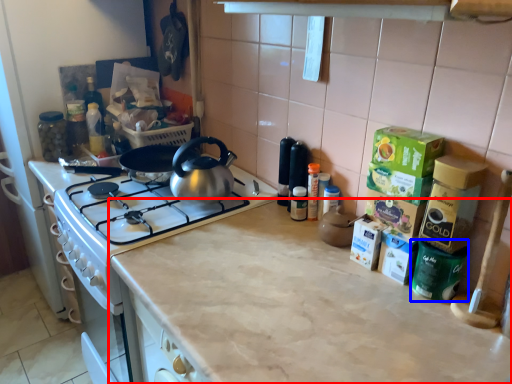
Question: Which object is further to the camera taking this photo, countertop (highlighted by a red box) or appliance (highlighted by a blue box)?

Choices:
 (A) countertop
 (B) appliance

Answer: (B)